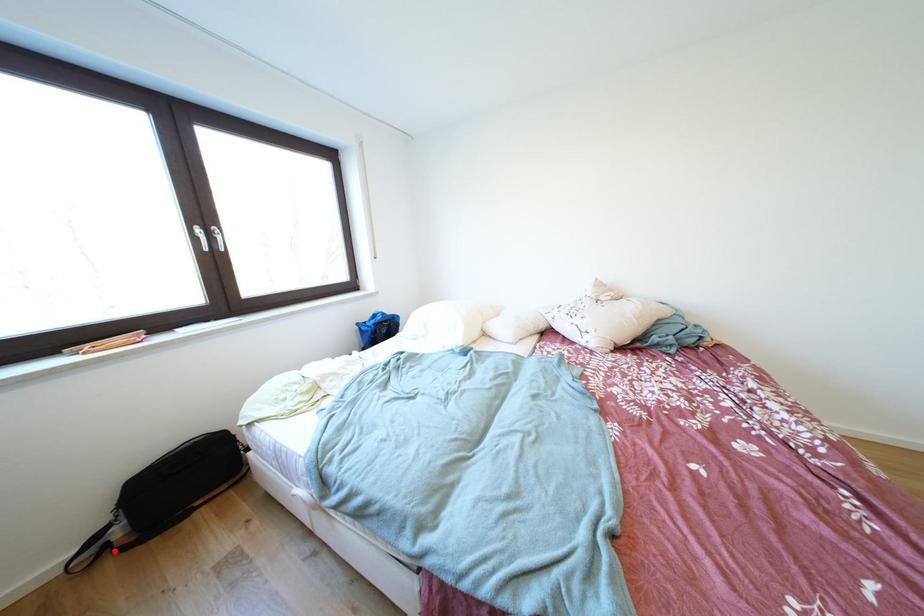
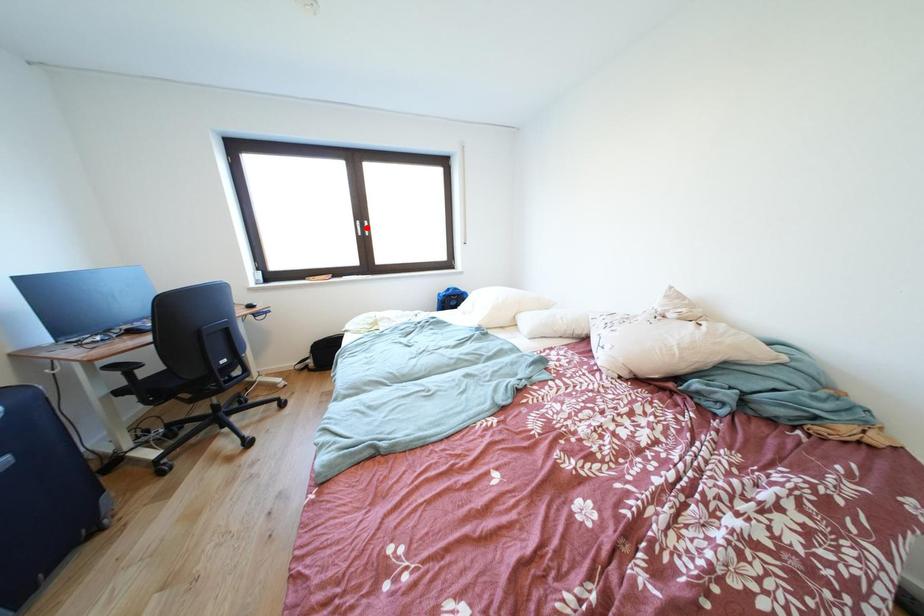
I am providing you with two images of the same scene from different viewpoints. A red point is marked on the first image and another point is marked on the second image. Is the red point in image1 aligned with the point shown in image2?

No